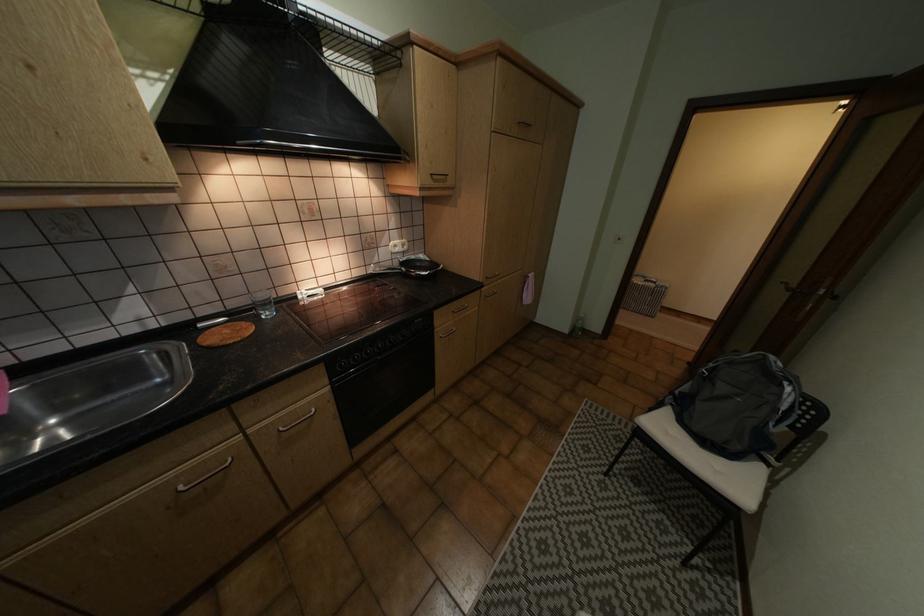
You are a GUI agent. You are given a task and a screenshot of the screen. Output one action in this format:
    pyautogui.click(x=<x>, y=<y>)
    Task: Click on the black oven knob
    This screenshot has width=924, height=616.
    Given the screenshot: What is the action you would take?
    pyautogui.click(x=359, y=354)